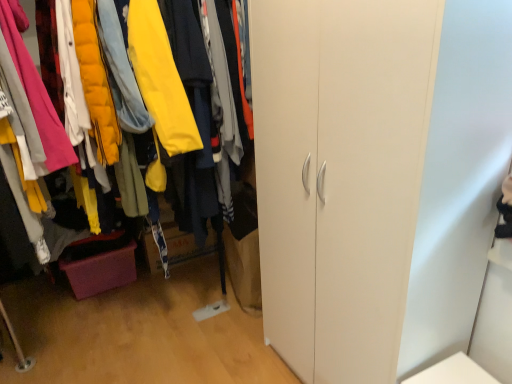
Locate an element on the screen. white matte cabinet at center is located at coordinates (31, 98).

This screenshot has width=512, height=384. What do you see at coordinates (31, 98) in the screenshot? I see `white matte cabinet at center` at bounding box center [31, 98].

Identify the location of white matte cabinet at center. Image resolution: width=512 pixels, height=384 pixels. (31, 98).